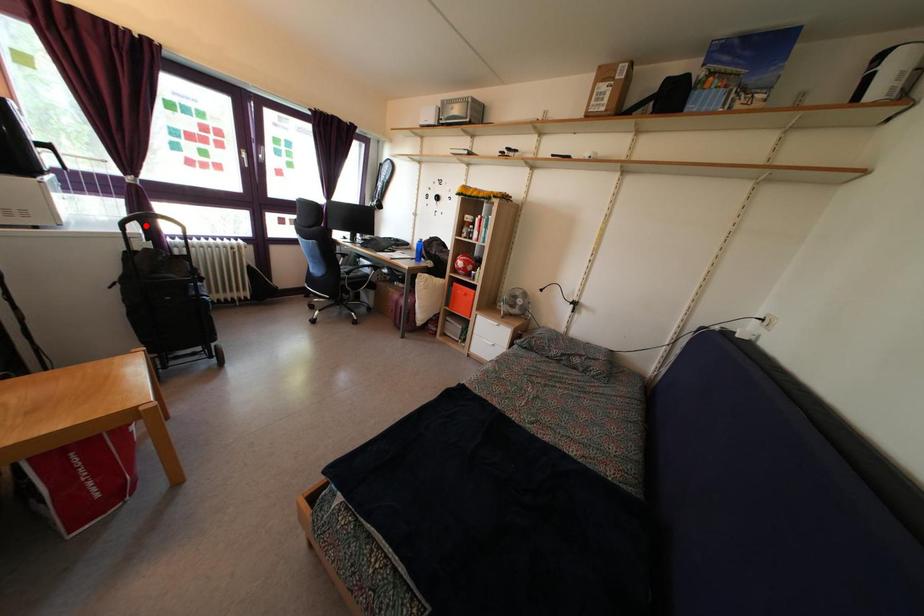
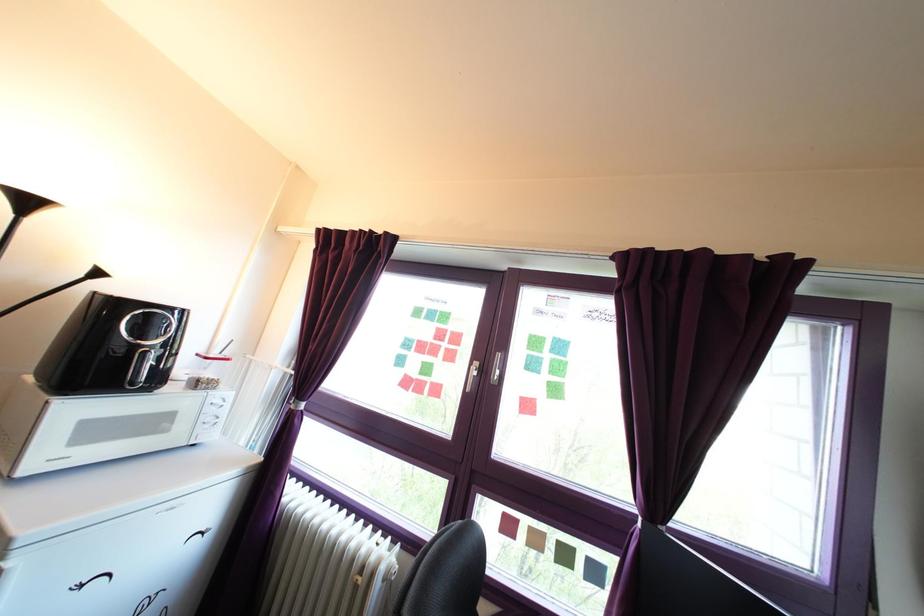
Where in the second image is the point corresponding to the highlighted location from the first image?

(219, 479)